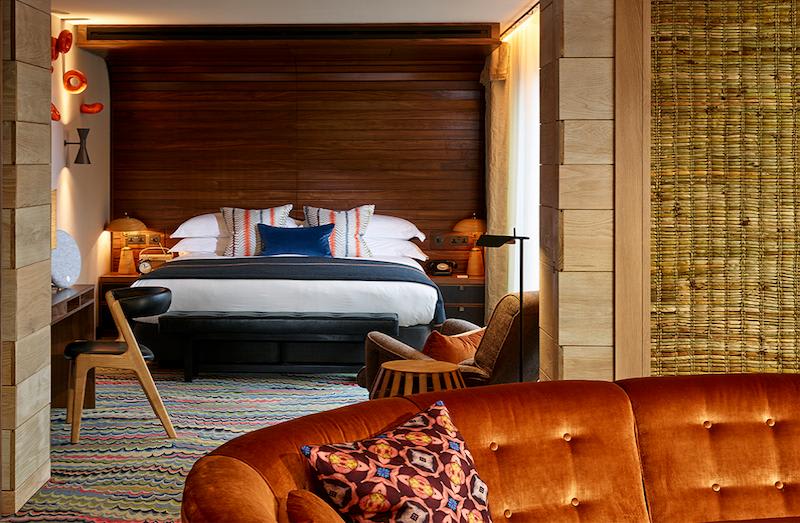
Locate an element on the screen. recliner is located at coordinates (493, 352).